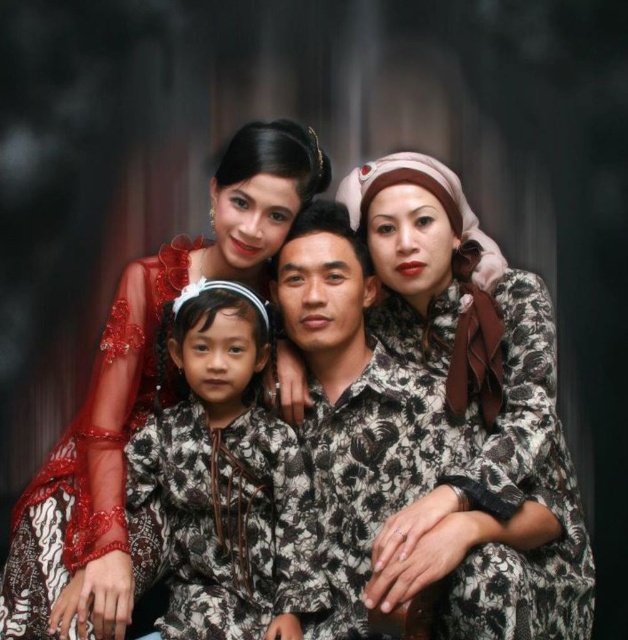
Is matte red sheer fabric at upper left further to camera compared to batik-patterned dress at center?

No, it is not.

Who is higher up, matte red sheer fabric at upper left or batik-patterned dress at center?

matte red sheer fabric at upper left is higher up.

Which is behind, point (257, 221) or point (202, 365)?

Positioned behind is point (257, 221).

Identify the location of matte red sheer fabric at upper left. The image size is (628, 640). (143, 394).

Is point (362, 186) farther from viewer compared to point (82, 493)?

Yes, it is.

What do you see at coordinates (474, 417) in the screenshot? This screenshot has width=628, height=640. I see `printed fabric blouse at center` at bounding box center [474, 417].

Is point (409, 294) positioned before point (129, 336)?

No, (409, 294) is behind (129, 336).

What are the coordinates of `printed fabric blouse at center` in the screenshot? It's located at (474, 417).

Does printed fabric blouse at center lie in front of batik-patterned dress at center?

That is True.

Is point (421, 234) closer to camera compared to point (239, 625)?

No, (421, 234) is behind (239, 625).

Is point (526, 344) more distant than point (154, 445)?

No, it is in front of (154, 445).

The width and height of the screenshot is (628, 640). I want to click on printed fabric blouse at center, so click(x=474, y=417).